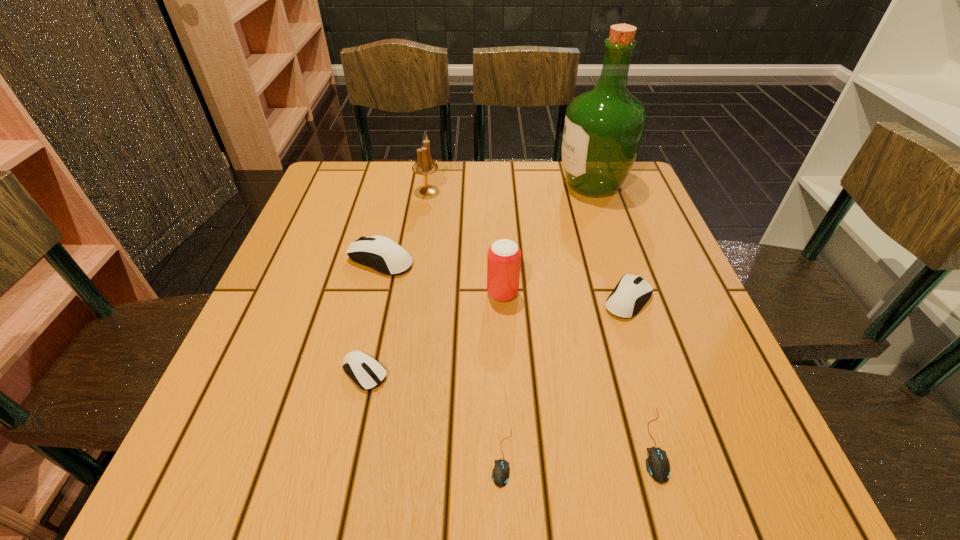
The height and width of the screenshot is (540, 960). In order to click on object present at the near right corner in this screenshot , I will do `click(657, 464)`.

Locate an element on the screen. The image size is (960, 540). free space at the far edge is located at coordinates (545, 196).

In the image, there is a desktop. Where is `vacant space at the left edge`? Image resolution: width=960 pixels, height=540 pixels. vacant space at the left edge is located at coordinates (301, 315).

This screenshot has height=540, width=960. In order to click on free region at the right edge in this screenshot , I will do `click(653, 334)`.

Locate an element on the screen. This screenshot has height=540, width=960. free spot at the far left corner of the desktop is located at coordinates (359, 183).

I want to click on vacant region at the near left corner of the desktop, so click(262, 484).

Where is `free space at the far right corner`? The width and height of the screenshot is (960, 540). free space at the far right corner is located at coordinates [609, 200].

The height and width of the screenshot is (540, 960). I want to click on free space that is in between the candle holder and the red beer can, so click(x=465, y=242).

The height and width of the screenshot is (540, 960). What are the coordinates of `empty location between the candle holder and the beer can` in the screenshot? It's located at (465, 242).

At what (x,y) coordinates should I click in order to perform the action: click on vacant area that lies between the beer can and the fourth tallest mouse. Please return your answer as a coordinate pair (x, y). The height and width of the screenshot is (540, 960). Looking at the image, I should click on (578, 369).